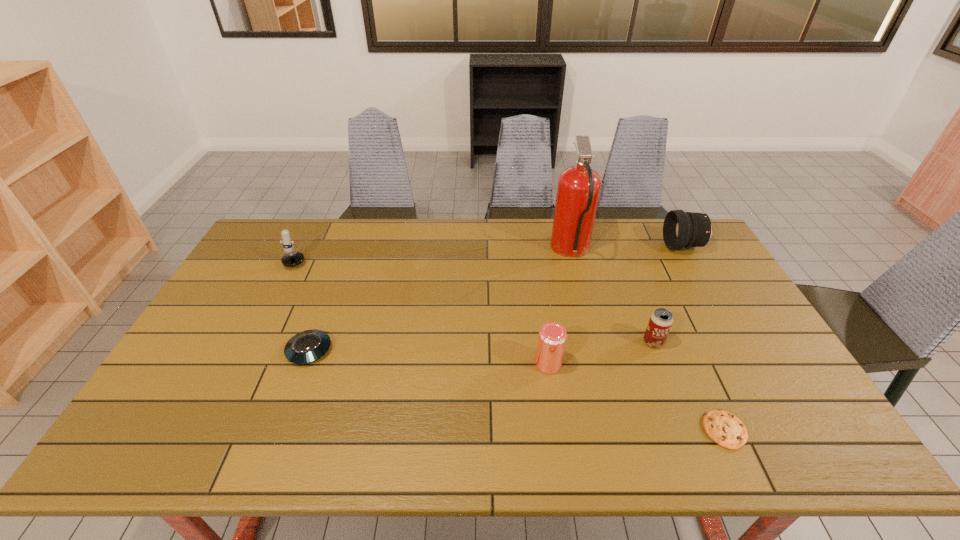
The height and width of the screenshot is (540, 960). What are the coordinates of `empty space between the second object from left to right and the microphone` in the screenshot? It's located at [x=304, y=302].

At what (x,y) coordinates should I click in order to perform the action: click on vacant area that lies between the left beer can and the rightmost object. Please return your answer as a coordinate pair (x, y). Looking at the image, I should click on (615, 305).

The image size is (960, 540). Find the location of `vacant space that is in between the saucer and the tallest object`. vacant space that is in between the saucer and the tallest object is located at coordinates [x=440, y=301].

In order to click on free space that is in between the fifth object from left to right and the rightmost object in this screenshot , I will do `click(668, 294)`.

Identify the location of free space between the leftmost object and the fourth object from right to left. (435, 253).

Find the location of a particular element. object identified as the fourth closest to the microphone is located at coordinates (661, 320).

Identify which object is the fourth nearest to the shortest object. Please provide its 2D coordinates. Your answer should be formatted as a tuple, i.e. [(x, y)], where the tuple contains the x and y coordinates of a point satisfying the conditions above.

[(681, 229)]

Find the location of `free spot that satisfies the following two spatial constraints: 1. on the back side of the second object from left to right; 2. on the left side of the third shortest object`. free spot that satisfies the following two spatial constraints: 1. on the back side of the second object from left to right; 2. on the left side of the third shortest object is located at coordinates (312, 342).

Find the location of `vacant point that satisfies the following two spatial constraints: 1. on the front side of the third object from left to right; 2. on the right side of the nearest object`. vacant point that satisfies the following two spatial constraints: 1. on the front side of the third object from left to right; 2. on the right side of the nearest object is located at coordinates (558, 430).